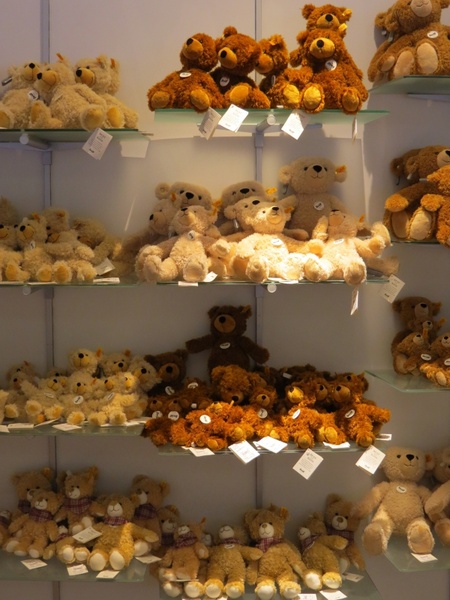
In order to click on sticker in this screenshot , I will do `click(293, 417)`.